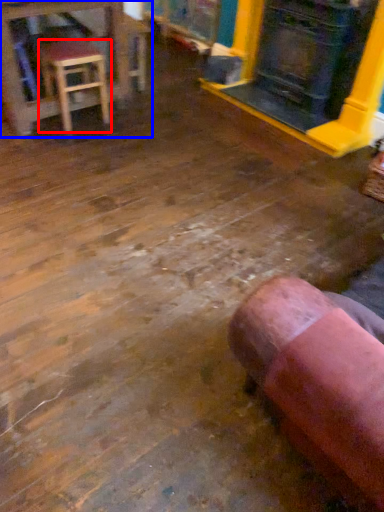
Question: Among these objects, which one is farthest to the camera, stool (highlighted by a red box) or table (highlighted by a blue box)?

Choices:
 (A) stool
 (B) table

Answer: (B)